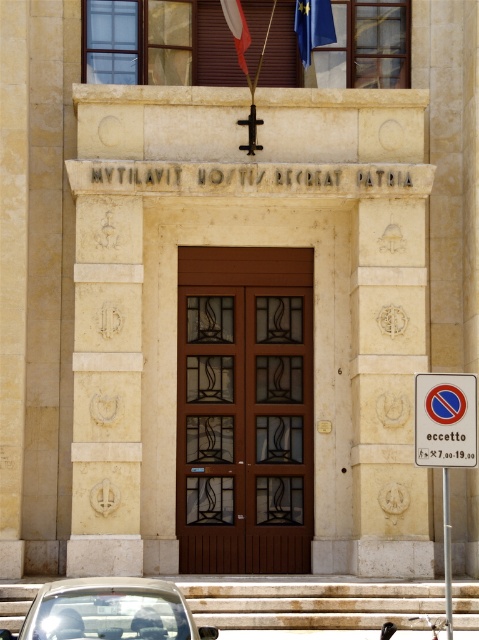
You are a delivery person standing at the entrance of the building. You need to place a 4.5 meter long package between the white plastic sign at right and the blue fabric flag at upper center. Is there enough space for the package?

The distance between the white plastic sign at right and the blue fabric flag at upper center is 5.08 meters, so the 4.5 meter long package will fit within the available space.

You are standing at the entrance of the building and want to locate the brown wooden door at center. According to the coordinates provided, where exactly is the door positioned relative to the entrance?

The brown wooden door at center is located at point coordinates 0.641 on the x axis and 0.511 on the y axis.

You are a visitor approaching the entrance of this classical building. You see a white plastic sign at right and a blue fabric flag at upper center. Which object is bigger in size?

The white plastic sign at right is larger in size than the blue fabric flag at upper center.